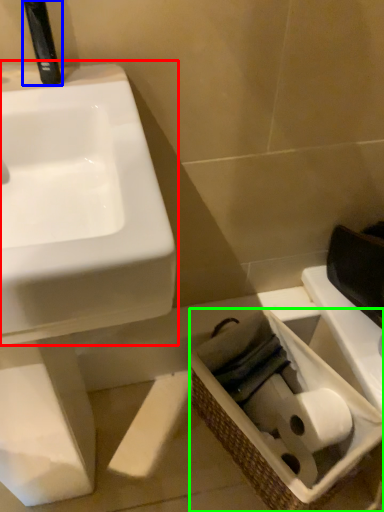
Question: Which object is the farthest from sink (highlighted by a red box)? Choose among these: plumbing fixture (highlighted by a blue box) or basket (highlighted by a green box).

Choices:
 (A) plumbing fixture
 (B) basket

Answer: (B)